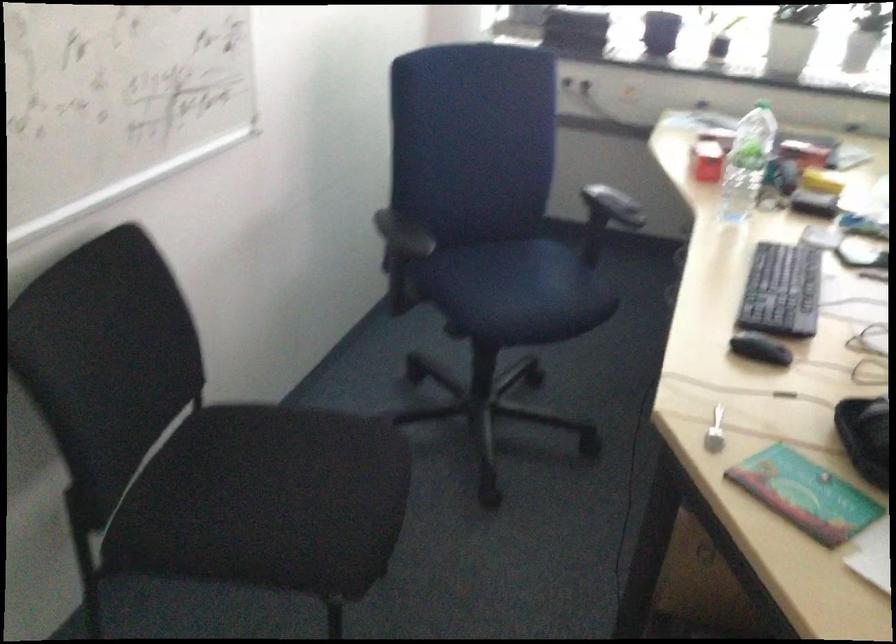
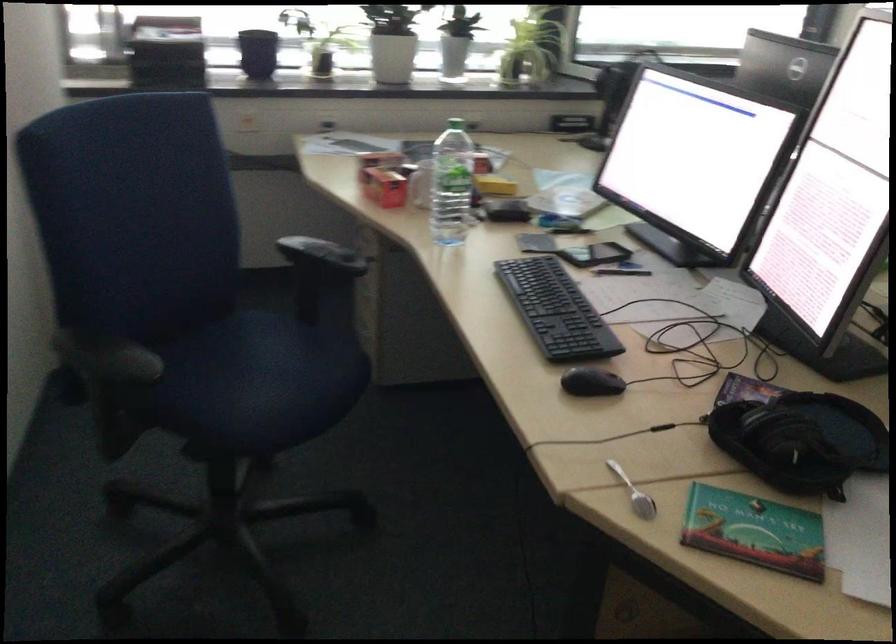
Where in the second image is the point corresponding to point (700, 153) from the first image?

(383, 185)